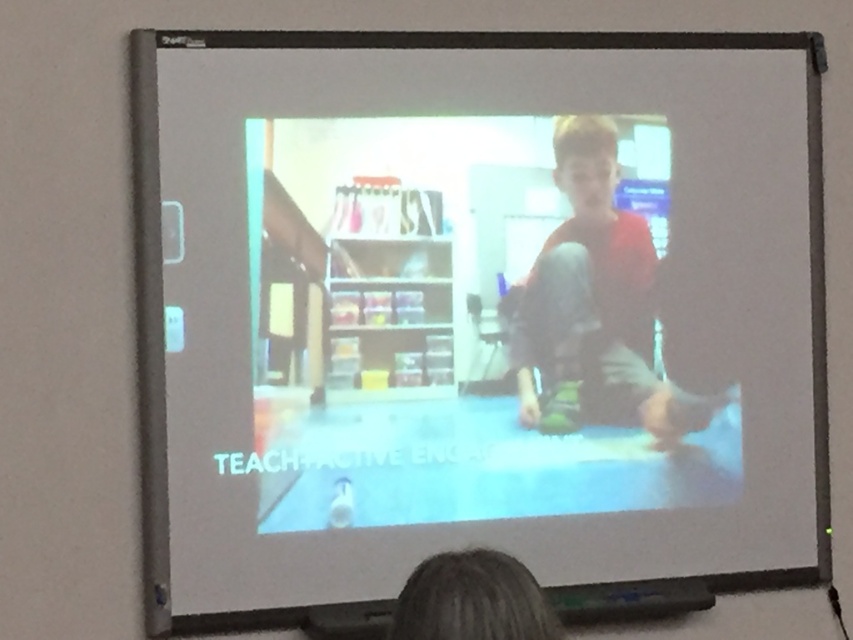
Question: Can you confirm if matte red shirt at center is positioned to the right of blonde hair at lower center?

Choices:
 (A) yes
 (B) no

Answer: (A)

Question: From the image, what is the correct spatial relationship of matte red shirt at center in relation to blonde hair at lower center?

Choices:
 (A) right
 (B) left

Answer: (A)

Question: Which of the following is the closest to the observer?

Choices:
 (A) (643, 236)
 (B) (466, 554)

Answer: (B)

Question: Can you confirm if matte red shirt at center is positioned below blonde hair at lower center?

Choices:
 (A) no
 (B) yes

Answer: (A)

Question: Which object appears farthest from the camera in this image?

Choices:
 (A) blonde hair at lower center
 (B) matte red shirt at center

Answer: (B)

Question: Which object is closer to the camera taking this photo?

Choices:
 (A) matte red shirt at center
 (B) blonde hair at lower center

Answer: (B)